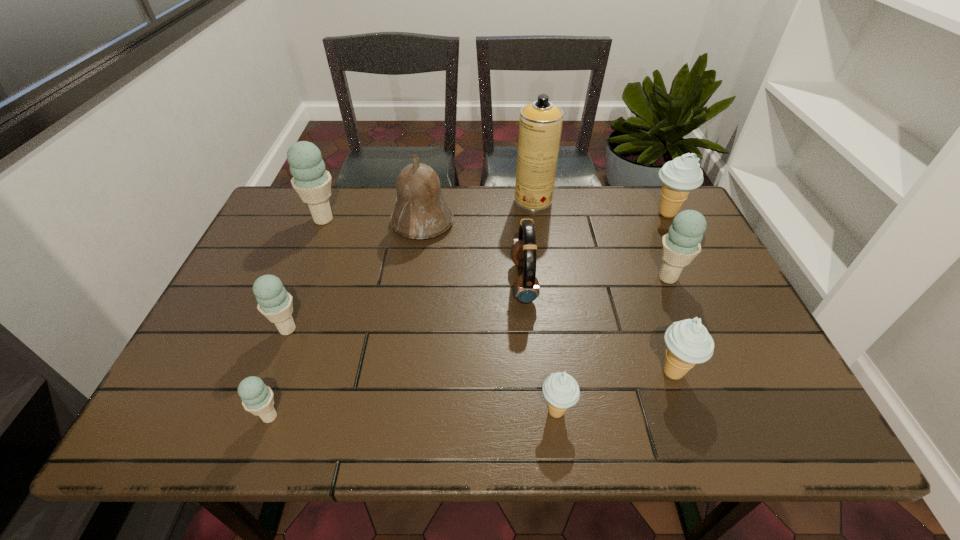
Locate an element on the screen. This screenshot has width=960, height=540. object at the far left corner is located at coordinates (311, 181).

Locate an element on the screen. object that is at the far right corner is located at coordinates (679, 176).

The image size is (960, 540). In order to click on free space at the far edge of the desktop in this screenshot , I will do tap(380, 193).

Where is `free spot at the left edge of the desktop`? The height and width of the screenshot is (540, 960). free spot at the left edge of the desktop is located at coordinates (215, 376).

Locate an element on the screen. This screenshot has width=960, height=540. vacant space at the right edge is located at coordinates (749, 392).

Where is `free spot at the far left corner of the desktop`? free spot at the far left corner of the desktop is located at coordinates (302, 212).

In the image, there is a desktop. What are the coordinates of `vacant space at the near left corner` in the screenshot? It's located at (187, 434).

Locate an element on the screen. The image size is (960, 540). free space between the smallest beige icecream and the second nearest beige icecream is located at coordinates (614, 392).

This screenshot has height=540, width=960. Find the location of `empty location between the smallest blue ice cream and the second biggest blue ice cream`. empty location between the smallest blue ice cream and the second biggest blue ice cream is located at coordinates (468, 347).

Find the location of a particular element. The width and height of the screenshot is (960, 540). empty space between the nearest beige icecream and the nearest blue ice cream is located at coordinates (413, 414).